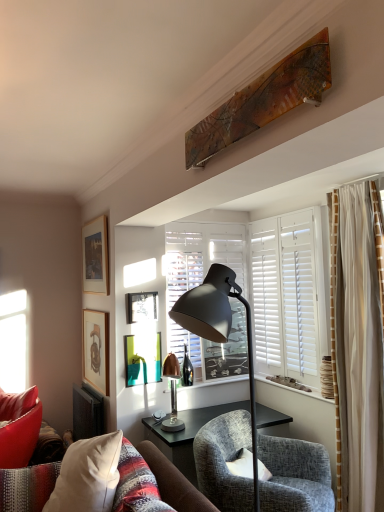
Question: Is textured gray armchair at center inside matte black picture frame at upper center, which ranks as the 3th picture frame in bottom-to-top order?

Choices:
 (A) yes
 (B) no

Answer: (B)

Question: From the image's perspective, is matte black picture frame at upper center, which is the second picture frame in top-to-bottom order, located beneath textured gray armchair at center?

Choices:
 (A) no
 (B) yes

Answer: (A)

Question: Is matte black picture frame at upper center, which is the second picture frame in top-to-bottom order, directly adjacent to textured gray armchair at center?

Choices:
 (A) yes
 (B) no

Answer: (B)

Question: From a real-world perspective, is matte black picture frame at upper center, which ranks as the 3th picture frame in bottom-to-top order, positioned under textured gray armchair at center based on gravity?

Choices:
 (A) yes
 (B) no

Answer: (B)

Question: From a real-world perspective, is matte black picture frame at upper center, which ranks as the 3th picture frame in bottom-to-top order, located higher than textured gray armchair at center?

Choices:
 (A) no
 (B) yes

Answer: (B)

Question: Is matte black picture frame at upper center, which ranks as the 3th picture frame in bottom-to-top order, taller than textured gray armchair at center?

Choices:
 (A) yes
 (B) no

Answer: (B)

Question: From the image's perspective, is copper metallic lamp at center, the 2th lamp from the front, beneath wooden matte picture frame at upper left, positioned as the fourth picture frame in top-to-bottom order?

Choices:
 (A) yes
 (B) no

Answer: (A)

Question: Is copper metallic lamp at center, which ranks as the first lamp in back-to-front order, smaller than wooden matte picture frame at upper left, the 1th picture frame ordered from the bottom?

Choices:
 (A) no
 (B) yes

Answer: (A)

Question: Is copper metallic lamp at center, the 2th lamp from the front, further to camera compared to wooden matte picture frame at upper left, positioned as the fourth picture frame in top-to-bottom order?

Choices:
 (A) no
 (B) yes

Answer: (A)

Question: Is copper metallic lamp at center, the 2th lamp from the front, with wooden matte picture frame at upper left, positioned as the fourth picture frame in top-to-bottom order?

Choices:
 (A) no
 (B) yes

Answer: (A)

Question: Can you confirm if copper metallic lamp at center, which ranks as the first lamp in back-to-front order, is thinner than wooden matte picture frame at upper left, positioned as the fourth picture frame in top-to-bottom order?

Choices:
 (A) no
 (B) yes

Answer: (A)

Question: Can you confirm if copper metallic lamp at center, which ranks as the first lamp in back-to-front order, is shorter than wooden matte picture frame at upper left, the 1th picture frame ordered from the bottom?

Choices:
 (A) yes
 (B) no

Answer: (A)

Question: Is wooden picture frame at upper left, placed as the fourth picture frame when sorted from bottom to top, facing towards matte black lamp at center, arranged as the 2th lamp when viewed from the back?

Choices:
 (A) no
 (B) yes

Answer: (A)